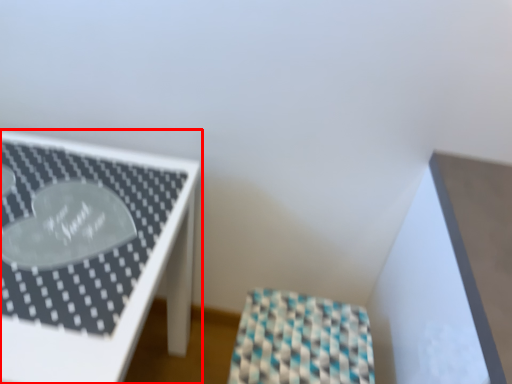
Question: From the image's perspective, considering the relative positions of furniture (annotated by the red box) and furniture in the image provided, where is furniture (annotated by the red box) located with respect to the staircase?

Choices:
 (A) above
 (B) below

Answer: (A)